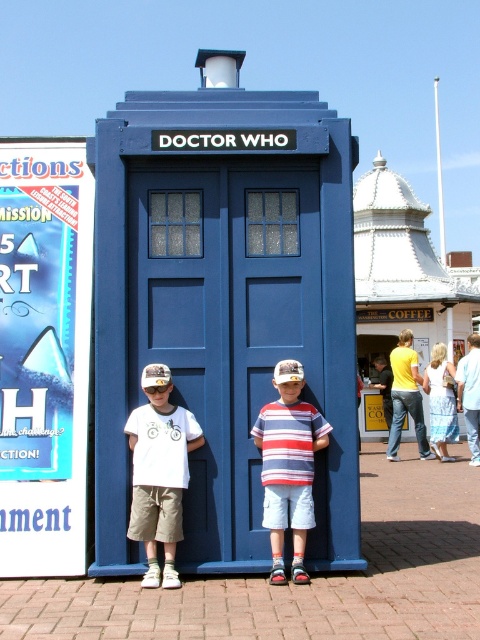
Looking at this image, you are standing in front of the Doctor Who blue box and want to touch the point at coordinates point (312, 499). Can you reach it without moving closer?

The point (312, 499) is 5.23 meters away from the viewer, so you cannot reach it without moving closer.